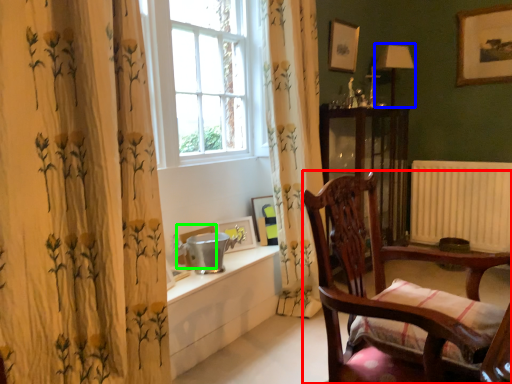
Question: Which object is positioned closest to furniture (highlighted by a red box)? Select from lamp (highlighted by a blue box) and picture frame (highlighted by a green box).

Choices:
 (A) lamp
 (B) picture frame

Answer: (B)